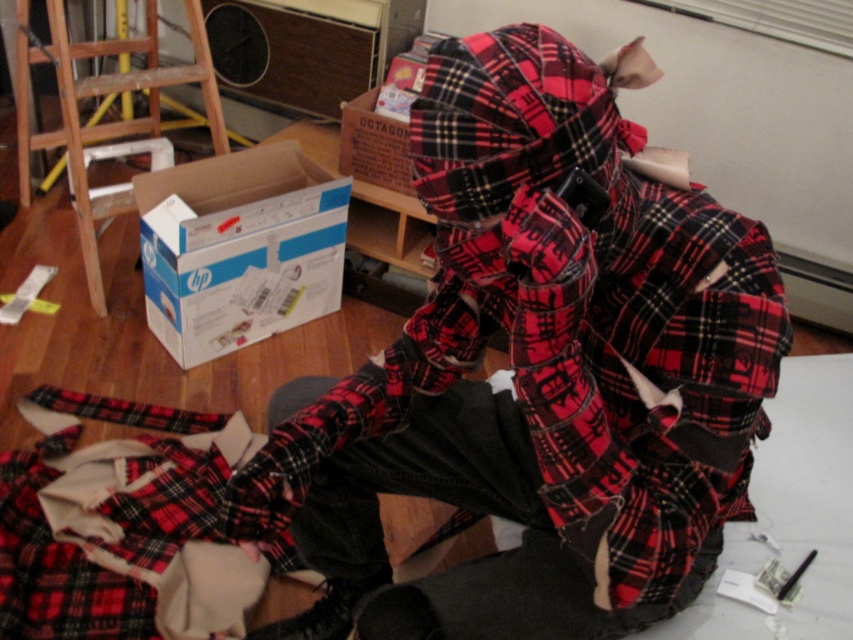
Question: Which point is closer to the camera taking this photo?

Choices:
 (A) (273, 316)
 (B) (640, 563)

Answer: (B)

Question: Which point is closer to the camera?

Choices:
 (A) (201, 33)
 (B) (143, 516)

Answer: (B)

Question: Which point is farther to the camera?

Choices:
 (A) (13, 570)
 (B) (566, 88)

Answer: (A)

Question: Is blue/white cardboard box at lower left wider than wooden at left?

Choices:
 (A) yes
 (B) no

Answer: (B)

Question: Can you confirm if red plaid fabric at lower left is positioned above blue/white cardboard box at lower left?

Choices:
 (A) yes
 (B) no

Answer: (B)

Question: Can you confirm if blue/white cardboard box at lower left is bigger than cardboard box at center?

Choices:
 (A) yes
 (B) no

Answer: (A)